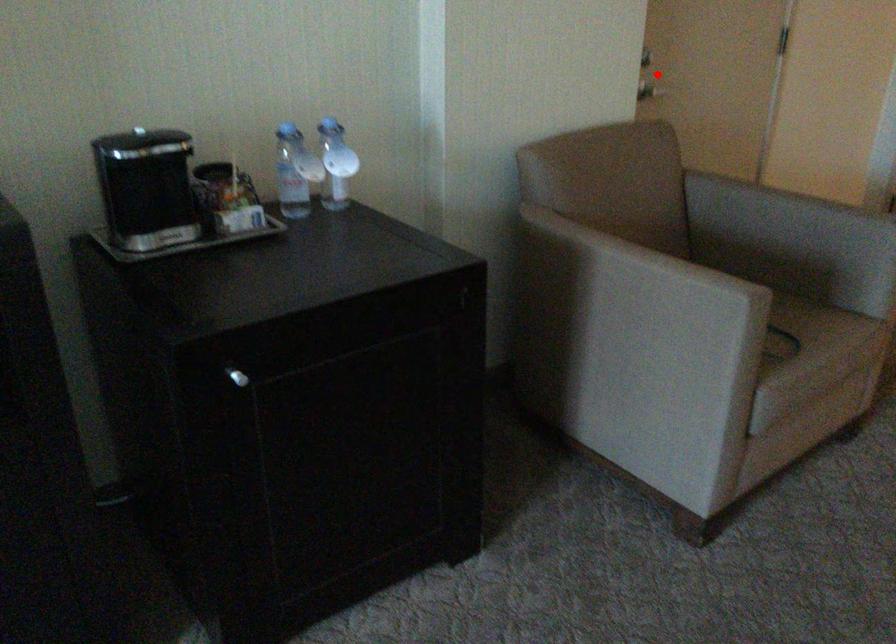
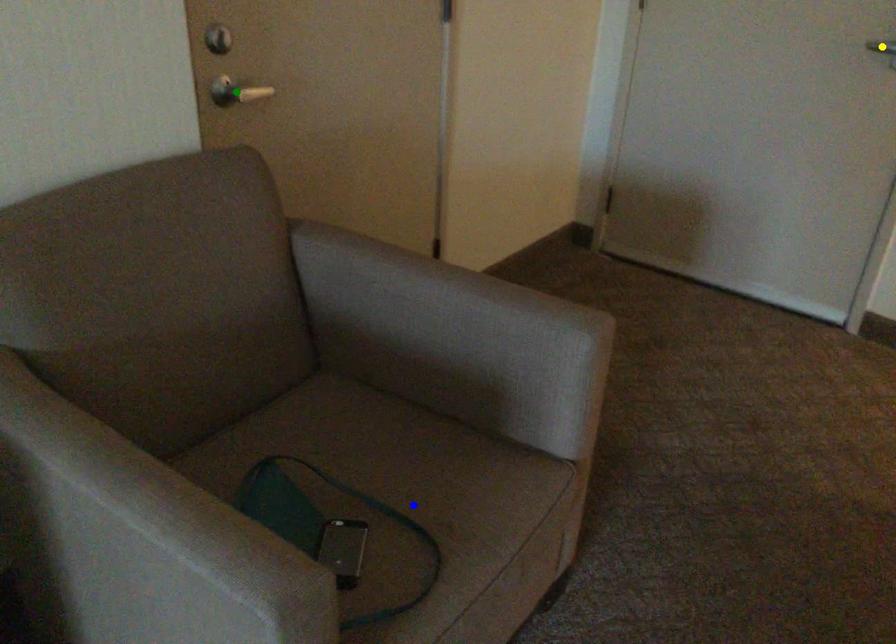
Question: I am providing you with two images of the same scene from different viewpoints. A red point is marked on the first image. You are given multiple points on the second image. Can you choose the point in image 2 that corresponds to the point in image 1?

Choices:
 (A) green point
 (B) yellow point
 (C) blue point

Answer: (A)